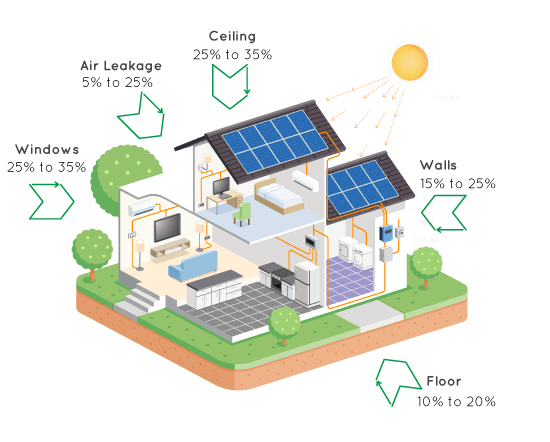
What are the coordinates of `bed` in the screenshot? It's located at (275, 194).